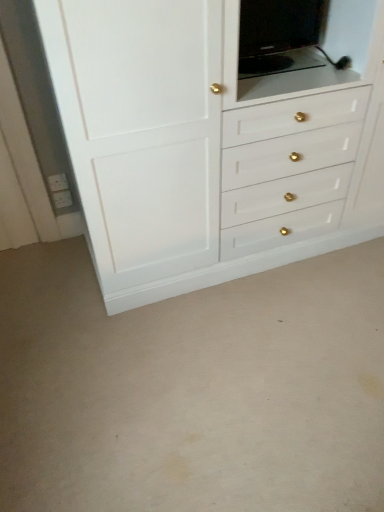
This screenshot has height=512, width=384. I want to click on white glossy cabinet at upper center, so click(209, 144).

The height and width of the screenshot is (512, 384). What do you see at coordinates (209, 144) in the screenshot?
I see `white glossy cabinet at upper center` at bounding box center [209, 144].

The width and height of the screenshot is (384, 512). In order to click on black glossy tv at upper center in this screenshot , I will do coord(278,35).

The width and height of the screenshot is (384, 512). What do you see at coordinates (278, 35) in the screenshot?
I see `black glossy tv at upper center` at bounding box center [278, 35].

This screenshot has height=512, width=384. In order to click on white glossy cabinet at upper center in this screenshot , I will do `click(209, 144)`.

Between white glossy cabinet at upper center and black glossy tv at upper center, which one appears on the right side from the viewer's perspective?

white glossy cabinet at upper center is more to the right.

Which is in front, white glossy cabinet at upper center or black glossy tv at upper center?

white glossy cabinet at upper center.

Between point (97, 231) and point (318, 7), which one is positioned behind?

Positioned behind is point (318, 7).

From the image's perspective, is white glossy cabinet at upper center under black glossy tv at upper center?

Indeed, from the image's perspective, white glossy cabinet at upper center is shown beneath black glossy tv at upper center.

From a real-world perspective, is white glossy cabinet at upper center physically above black glossy tv at upper center?

No, from a real-world perspective, white glossy cabinet at upper center is not over black glossy tv at upper center

In terms of width, does white glossy cabinet at upper center look wider or thinner when compared to black glossy tv at upper center?

white glossy cabinet at upper center is wider than black glossy tv at upper center.

From the picture: Between white glossy cabinet at upper center and black glossy tv at upper center, which one has more height?

With more height is white glossy cabinet at upper center.

From the picture: Can you confirm if white glossy cabinet at upper center is smaller than black glossy tv at upper center?

No.

Could black glossy tv at upper center be considered to be inside white glossy cabinet at upper center?

Yes, black glossy tv at upper center is a part of white glossy cabinet at upper center.

Is white glossy cabinet at upper center with black glossy tv at upper center?

No, white glossy cabinet at upper center is not in contact with black glossy tv at upper center.

Is white glossy cabinet at upper center oriented towards black glossy tv at upper center?

Yes, white glossy cabinet at upper center is turned towards black glossy tv at upper center.

Can you tell me how much white glossy cabinet at upper center and black glossy tv at upper center differ in facing direction?

0.000673 degrees separate the facing orientations of white glossy cabinet at upper center and black glossy tv at upper center.

How much distance is there between white glossy cabinet at upper center and black glossy tv at upper center?

They are 16.45 inches apart.

Where is `medicine cabinet lying above the white glossy cabinet at upper center (from the image's perspective)`? This screenshot has width=384, height=512. medicine cabinet lying above the white glossy cabinet at upper center (from the image's perspective) is located at coordinates (278, 35).

Consider the image. Is black glossy tv at upper center to the left of white glossy cabinet at upper center from the viewer's perspective?

Yes.

Does black glossy tv at upper center come behind white glossy cabinet at upper center?

Yes, the depth of black glossy tv at upper center is greater than that of white glossy cabinet at upper center.

In the scene shown: Which point is more distant from viewer, (242, 70) or (334, 100)?

The point (242, 70) is farther.

Looking at this image, from the image's perspective, relative to white glossy cabinet at upper center, is black glossy tv at upper center above or below?

Clearly, from the image's perspective, black glossy tv at upper center is above white glossy cabinet at upper center.

From a real-world perspective, relative to white glossy cabinet at upper center, is black glossy tv at upper center vertically above or below?

black glossy tv at upper center is above white glossy cabinet at upper center.

Between black glossy tv at upper center and white glossy cabinet at upper center, which one has larger width?

white glossy cabinet at upper center.

Between black glossy tv at upper center and white glossy cabinet at upper center, which one has less height?

With less height is black glossy tv at upper center.

Based on their sizes in the image, would you say black glossy tv at upper center is bigger or smaller than white glossy cabinet at upper center?

Clearly, black glossy tv at upper center is smaller in size than white glossy cabinet at upper center.

Can we say black glossy tv at upper center lies outside white glossy cabinet at upper center?

No, black glossy tv at upper center is not outside of white glossy cabinet at upper center.

Would you say black glossy tv at upper center is a long distance from white glossy cabinet at upper center?

No.

In the scene shown: Could you tell me if black glossy tv at upper center is facing white glossy cabinet at upper center?

A: Yes, black glossy tv at upper center is facing white glossy cabinet at upper center.

Can you tell me how much black glossy tv at upper center and white glossy cabinet at upper center differ in facing direction?

0.000673 degrees separate the facing orientations of black glossy tv at upper center and white glossy cabinet at upper center.

You are a GUI agent. You are given a task and a screenshot of the screen. Output one action in this format:
    pyautogui.click(x=<x>, y=<y>)
    Task: Click on the chest of drawers that is below the black glossy tv at upper center (from the image's perspective)
    The height and width of the screenshot is (512, 384).
    Given the screenshot: What is the action you would take?
    pyautogui.click(x=209, y=144)

The image size is (384, 512). What are the coordinates of `medicine cabinet lying behind the white glossy cabinet at upper center` in the screenshot? It's located at (278, 35).

Find the location of a particular element. This screenshot has width=384, height=512. the chest of drawers located below the black glossy tv at upper center (from the image's perspective) is located at coordinates (209, 144).